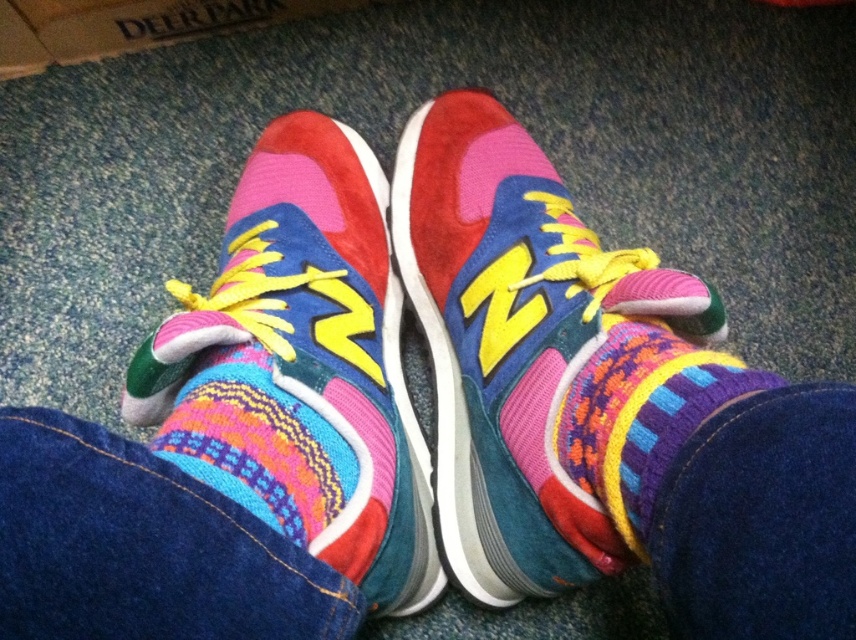
Is point (405, 520) positioned before point (56, 49)?

Yes, point (405, 520) is in front of point (56, 49).

Does suede/multicolored sneaker at center have a smaller size compared to cardboard at upper left?

Actually, suede/multicolored sneaker at center might be larger than cardboard at upper left.

The height and width of the screenshot is (640, 856). Find the location of `suede/multicolored sneaker at center`. suede/multicolored sneaker at center is located at coordinates (301, 368).

Between multicolored suede sneaker at center and knitted woolen sock at center, which one is positioned higher?

multicolored suede sneaker at center is above.

Where is `multicolored suede sneaker at center`? The height and width of the screenshot is (640, 856). multicolored suede sneaker at center is located at coordinates (531, 353).

Can you confirm if multicolored suede sneaker at center is positioned to the right of suede/multicolored sneaker at center?

Indeed, multicolored suede sneaker at center is positioned on the right side of suede/multicolored sneaker at center.

Is point (480, 374) in front of point (415, 556)?

That is False.

Between point (609, 572) and point (395, 388), which one is positioned behind?

Point (395, 388)

I want to click on multicolored suede sneaker at center, so click(531, 353).